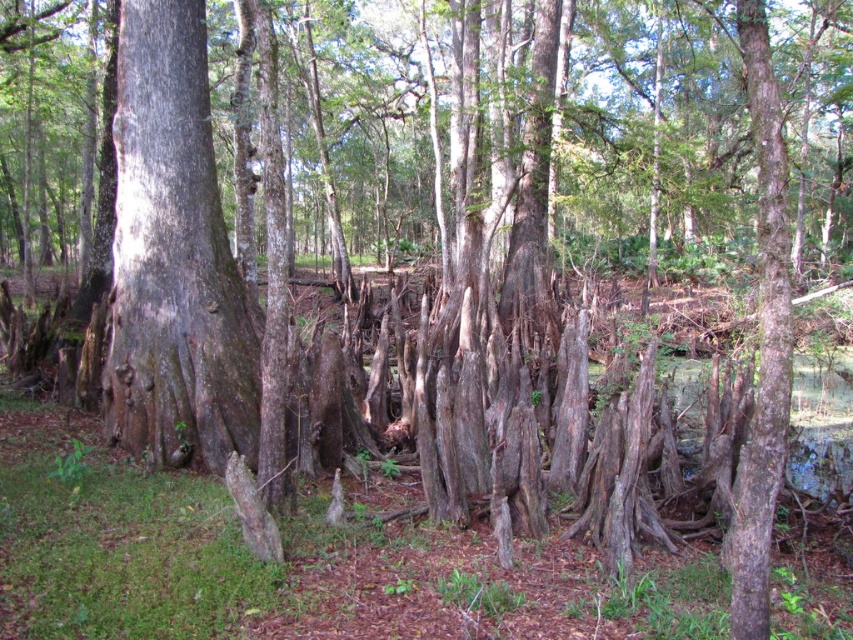
Question: Which point is farther from the camera taking this photo?

Choices:
 (A) (770, 232)
 (B) (202, 380)

Answer: (B)

Question: Which point is closer to the camera?

Choices:
 (A) smooth gray bark at center
 (B) smooth bark tree trunk at right

Answer: (B)

Question: Is smooth gray bark at center thinner than smooth bark tree trunk at right?

Choices:
 (A) yes
 (B) no

Answer: (B)

Question: Observing the image, what is the correct spatial positioning of smooth gray bark at center in reference to smooth bark tree trunk at right?

Choices:
 (A) right
 (B) left

Answer: (B)

Question: Considering the relative positions of smooth gray bark at center and smooth bark tree trunk at right in the image provided, where is smooth gray bark at center located with respect to smooth bark tree trunk at right?

Choices:
 (A) right
 (B) left

Answer: (B)

Question: Which point appears closest to the camera in this image?

Choices:
 (A) (758, 378)
 (B) (177, 93)

Answer: (A)